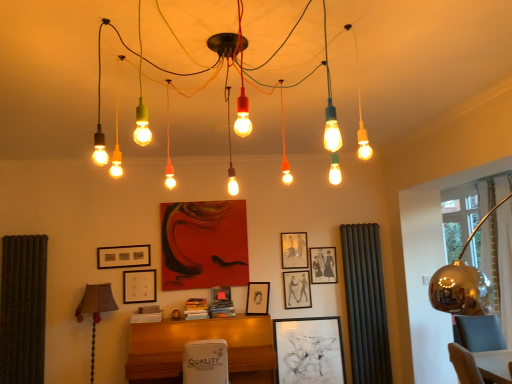
Image resolution: width=512 pixels, height=384 pixels. Describe the element at coordinates (204, 244) in the screenshot. I see `red matte painting at center, the 7th picture frame in the right-to-left sequence` at that location.

Image resolution: width=512 pixels, height=384 pixels. What do you see at coordinates (221, 295) in the screenshot?
I see `matte black picture frame at center, marked as the fourth picture frame in a left-to-right arrangement` at bounding box center [221, 295].

Looking at this image, measure the distance between point (333, 263) and camera.

Point (333, 263) and camera are 4.64 meters apart.

Describe the element at coordinates (294, 250) in the screenshot. The width and height of the screenshot is (512, 384). I see `matte black picture frame at upper center, the 4th picture frame viewed from the right` at that location.

At what (x,y) coordinates should I click in order to perform the action: click on black matte picture frame at center, arranged as the 8th picture frame when viewed from the left. Please return your answer as a coordinate pair (x, y). Looking at the image, I should click on (309, 350).

From their relative heights in the image, would you say matte black picture frame at center, the 7th picture frame from the left, is taller or shorter than black matte picture frame at center, which ranks as the 2th picture frame in right-to-left order?

Clearly, matte black picture frame at center, the 7th picture frame from the left, is shorter compared to black matte picture frame at center, which ranks as the 2th picture frame in right-to-left order.

Which object is thinner, matte black picture frame at center, the 7th picture frame from the left, or black matte picture frame at center, arranged as the 8th picture frame when viewed from the left?

Thinner between the two is matte black picture frame at center, the 7th picture frame from the left.

Which of these two, matte black picture frame at center, positioned as the third picture frame in right-to-left order, or black matte picture frame at center, arranged as the 8th picture frame when viewed from the left, is bigger?

With larger size is black matte picture frame at center, arranged as the 8th picture frame when viewed from the left.

Are matte black picture frame at center, positioned as the third picture frame in right-to-left order, and black matte picture frame at center, which ranks as the 2th picture frame in right-to-left order, making contact?

No, matte black picture frame at center, positioned as the third picture frame in right-to-left order, is not making contact with black matte picture frame at center, which ranks as the 2th picture frame in right-to-left order.

Is black matte picture frame at center, arranged as the 8th picture frame when viewed from the left, oriented towards matte black picture frame at center, the 5th picture frame positioned from the right?

No, black matte picture frame at center, arranged as the 8th picture frame when viewed from the left, is not aimed at matte black picture frame at center, the 5th picture frame positioned from the right.

Consider the image. Based on their sizes in the image, would you say black matte picture frame at center, which ranks as the 2th picture frame in right-to-left order, is bigger or smaller than matte black picture frame at center, the 5th picture frame positioned from the right?

black matte picture frame at center, which ranks as the 2th picture frame in right-to-left order, is bigger than matte black picture frame at center, the 5th picture frame positioned from the right.

From a real-world perspective, is black matte picture frame at center, arranged as the 8th picture frame when viewed from the left, over matte black picture frame at center, the 5th picture frame positioned from the right?

Actually, black matte picture frame at center, arranged as the 8th picture frame when viewed from the left, is physically below matte black picture frame at center, the 5th picture frame positioned from the right, in the real world.

Locate an element on the screen. The width and height of the screenshot is (512, 384). the 1st picture frame behind the black matte picture frame at center, arranged as the 8th picture frame when viewed from the left is located at coordinates (258, 298).

Considering the sizes of objects red matte painting at center, which is the third picture frame in left-to-right order, and black fabric curtain at right in the image provided, who is thinner, red matte painting at center, which is the third picture frame in left-to-right order, or black fabric curtain at right?

black fabric curtain at right.

Considering the relative positions of red matte painting at center, the 7th picture frame in the right-to-left sequence, and black fabric curtain at right in the image provided, is red matte painting at center, the 7th picture frame in the right-to-left sequence, to the left of black fabric curtain at right from the viewer's perspective?

Correct, you'll find red matte painting at center, the 7th picture frame in the right-to-left sequence, to the left of black fabric curtain at right.

Which object is closer to the camera, red matte painting at center, the 7th picture frame in the right-to-left sequence, or black fabric curtain at right?

red matte painting at center, the 7th picture frame in the right-to-left sequence, is in front.

From a real-world perspective, between red matte painting at center, which is the third picture frame in left-to-right order, and black fabric curtain at right, who is vertically lower?

black fabric curtain at right.

Which object is positioned more to the right, black matte picture frame at upper left, the 9th picture frame from the right, or brown fabric lampshade at lower left?

Positioned to the right is black matte picture frame at upper left, the 9th picture frame from the right.

From a real-world perspective, count 7th picture frames upward from the brown fabric lampshade at lower left and point to it. Please provide its 2D coordinates.

[(123, 256)]

From a real-world perspective, which is physically below, black matte picture frame at upper left, the 1th picture frame when ordered from left to right, or brown fabric lampshade at lower left?

In real-world perspective, brown fabric lampshade at lower left is lower.

Consider the image. From the image's perspective, would you say black matte picture frame at upper left, the 9th picture frame from the right, is shown under brown fabric lampshade at lower left?

Actually, black matte picture frame at upper left, the 9th picture frame from the right, appears above brown fabric lampshade at lower left in the image.

From the picture: Is matte black picture frame at center, the 7th picture frame from the left, wider than red matte painting at center, the 7th picture frame in the right-to-left sequence?

In fact, matte black picture frame at center, the 7th picture frame from the left, might be narrower than red matte painting at center, the 7th picture frame in the right-to-left sequence.

Is matte black picture frame at center, the 7th picture frame from the left, outside of red matte painting at center, which is the third picture frame in left-to-right order?

Yes, matte black picture frame at center, the 7th picture frame from the left, is located beyond the bounds of red matte painting at center, which is the third picture frame in left-to-right order.

Between matte black picture frame at center, the 7th picture frame from the left, and red matte painting at center, the 7th picture frame in the right-to-left sequence, which one appears on the left side from the viewer's perspective?

red matte painting at center, the 7th picture frame in the right-to-left sequence.

From the image's perspective, is red matte painting at center, the 7th picture frame in the right-to-left sequence, located above or below matte white picture frame at center, acting as the 2th picture frame starting from the left?

red matte painting at center, the 7th picture frame in the right-to-left sequence, is above matte white picture frame at center, acting as the 2th picture frame starting from the left.

Who is shorter, red matte painting at center, the 7th picture frame in the right-to-left sequence, or matte white picture frame at center, acting as the 2th picture frame starting from the left?

Standing shorter between the two is matte white picture frame at center, acting as the 2th picture frame starting from the left.

Looking at this image, what's the angular difference between red matte painting at center, the 7th picture frame in the right-to-left sequence, and matte white picture frame at center, acting as the 2th picture frame starting from the left,'s facing directions?

The facing directions of red matte painting at center, the 7th picture frame in the right-to-left sequence, and matte white picture frame at center, acting as the 2th picture frame starting from the left, are 1.68 degrees apart.

Is red matte painting at center, which is the third picture frame in left-to-right order, directly adjacent to matte white picture frame at center, acting as the 2th picture frame starting from the left?

No, red matte painting at center, which is the third picture frame in left-to-right order, is not next to matte white picture frame at center, acting as the 2th picture frame starting from the left.

Considering the relative sizes of black matte picture frame at center, which ranks as the 2th picture frame in right-to-left order, and matte black picture frame at center, the 7th picture frame from the left, in the image provided, is black matte picture frame at center, which ranks as the 2th picture frame in right-to-left order, smaller than matte black picture frame at center, the 7th picture frame from the left,?

No, black matte picture frame at center, which ranks as the 2th picture frame in right-to-left order, is not smaller than matte black picture frame at center, the 7th picture frame from the left.

Can you confirm if black matte picture frame at center, arranged as the 8th picture frame when viewed from the left, is positioned to the right of matte black picture frame at center, the 7th picture frame from the left?

Indeed, black matte picture frame at center, arranged as the 8th picture frame when viewed from the left, is positioned on the right side of matte black picture frame at center, the 7th picture frame from the left.

Are black matte picture frame at center, which ranks as the 2th picture frame in right-to-left order, and matte black picture frame at center, the 7th picture frame from the left, making contact?

No, black matte picture frame at center, which ranks as the 2th picture frame in right-to-left order, is not touching matte black picture frame at center, the 7th picture frame from the left.

Which of these two, black matte picture frame at center, arranged as the 8th picture frame when viewed from the left, or matte black picture frame at center, positioned as the third picture frame in right-to-left order, is wider?

black matte picture frame at center, arranged as the 8th picture frame when viewed from the left, is wider.

The height and width of the screenshot is (384, 512). What are the coordinates of `picture frame that is the 2nd one below the matte black picture frame at center, the 7th picture frame from the left (from a real-world perspective)` in the screenshot? It's located at coord(309,350).

Identify the location of picture frame located in front of the matte black picture frame at center, the 5th picture frame positioned from the right. (309, 350).

Estimate the real-world distances between objects in this image. Which object is further from black matte picture frame at upper left, the 9th picture frame from the right, matte black picture frame at center, acting as the sixth picture frame starting from the right, or brown fabric lampshade at lower left?

Among the two, matte black picture frame at center, acting as the sixth picture frame starting from the right, is located further to black matte picture frame at upper left, the 9th picture frame from the right.

Based on their spatial positions, is matte black picture frame at center, acting as the sixth picture frame starting from the right, or black matte picture frame at upper left, the 1th picture frame when ordered from left to right, closer to matte black picture frame at center, the 1th picture frame from the right?

Among the two, matte black picture frame at center, acting as the sixth picture frame starting from the right, is located nearer to matte black picture frame at center, the 1th picture frame from the right.

Based on their spatial positions, is brown fabric lampshade at lower left or black matte picture frame at upper left, the 1th picture frame when ordered from left to right, further from matte black picture frame at center, which ranks as the 5th picture frame in left-to-right order?

Based on the image, brown fabric lampshade at lower left appears to be further to matte black picture frame at center, which ranks as the 5th picture frame in left-to-right order.

Looking at the image, which one is located closer to brown fabric lampshade at lower left, matte black picture frame at center, the 7th picture frame from the left, or multicolored glass bulbs at center?

The object closer to brown fabric lampshade at lower left is matte black picture frame at center, the 7th picture frame from the left.

Considering their positions, is black matte picture frame at center, arranged as the 8th picture frame when viewed from the left, positioned further to matte black picture frame at upper center, the 4th picture frame viewed from the right, than brown fabric lampshade at lower left?

brown fabric lampshade at lower left is further to matte black picture frame at upper center, the 4th picture frame viewed from the right.

Based on their spatial positions, is black fabric curtain at right or multicolored glass bulbs at center closer to black matte picture frame at upper left, the 9th picture frame from the right?

multicolored glass bulbs at center lies closer to black matte picture frame at upper left, the 9th picture frame from the right, than the other object.

Based on their spatial positions, is matte black picture frame at center, the 1th picture frame from the right, or matte black picture frame at center, which ranks as the 5th picture frame in left-to-right order, further from wooden desk at center?

Based on the image, matte black picture frame at center, the 1th picture frame from the right, appears to be further to wooden desk at center.

Based on their spatial positions, is wooden desk at center or matte black picture frame at center, the 1th picture frame from the right, further from black fabric curtain at right?

Based on the image, wooden desk at center appears to be further to black fabric curtain at right.

Locate an element on the screen. The height and width of the screenshot is (384, 512). furniture located between black matte picture frame at upper left, the 9th picture frame from the right, and matte black picture frame at center, acting as the sixth picture frame starting from the right, in the left-right direction is located at coordinates (201, 339).

The height and width of the screenshot is (384, 512). What are the coordinates of `furniture between brown fabric lampshade at lower left and matte black picture frame at center, positioned as the third picture frame in right-to-left order` in the screenshot? It's located at (201, 339).

Identify the location of picture frame between matte white picture frame at center, the 8th picture frame viewed from the right, and matte black picture frame at center, acting as the sixth picture frame starting from the right. (204, 244).

Locate an element on the screen. curtain between matte black picture frame at upper center, the 4th picture frame viewed from the right, and black matte picture frame at center, which ranks as the 2th picture frame in right-to-left order, from top to bottom is located at coordinates (366, 304).